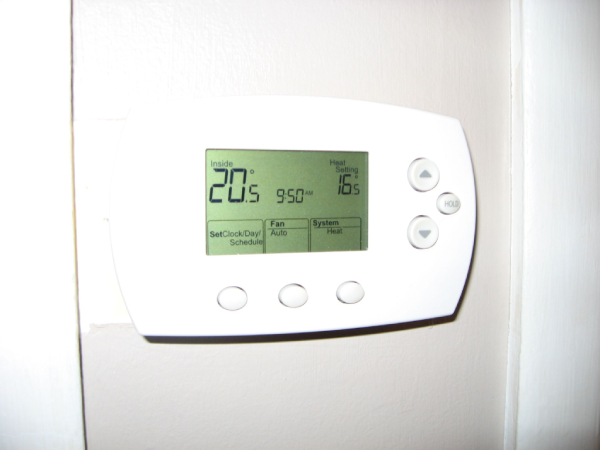
Where is `thermostat`? thermostat is located at coordinates (392, 289).